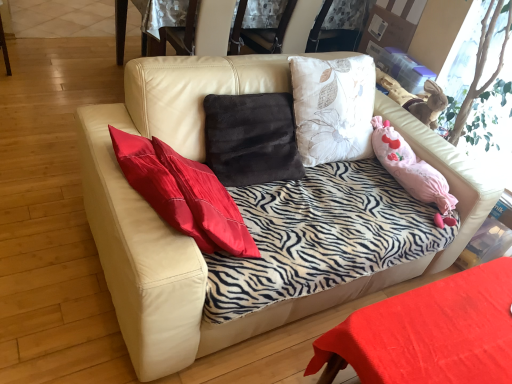
Question: From the image's perspective, is smooth red table at lower right under leather couch at center?

Choices:
 (A) no
 (B) yes

Answer: (B)

Question: From a real-world perspective, is smooth red table at lower right physically below leather couch at center?

Choices:
 (A) yes
 (B) no

Answer: (A)

Question: Can you confirm if smooth red table at lower right is smaller than leather couch at center?

Choices:
 (A) yes
 (B) no

Answer: (A)

Question: Considering the relative sizes of smooth red table at lower right and leather couch at center in the image provided, is smooth red table at lower right taller than leather couch at center?

Choices:
 (A) no
 (B) yes

Answer: (A)

Question: Is the depth of smooth red table at lower right less than that of leather couch at center?

Choices:
 (A) yes
 (B) no

Answer: (B)

Question: Considering the positions of point (181, 296) and point (452, 360), is point (181, 296) closer or farther from the camera than point (452, 360)?

Choices:
 (A) farther
 (B) closer

Answer: (B)

Question: From the image's perspective, is leather couch at center located above or below smooth red table at lower right?

Choices:
 (A) below
 (B) above

Answer: (B)

Question: Considering the positions of leather couch at center and smooth red table at lower right in the image, is leather couch at center wider or thinner than smooth red table at lower right?

Choices:
 (A) thin
 (B) wide

Answer: (B)

Question: In the image, is leather couch at center on the left side or the right side of smooth red table at lower right?

Choices:
 (A) left
 (B) right

Answer: (A)

Question: From the image's perspective, is smooth red table at lower right above or below leather at upper center?

Choices:
 (A) above
 (B) below

Answer: (B)

Question: From a real-world perspective, relative to leather at upper center, is smooth red table at lower right vertically above or below?

Choices:
 (A) above
 (B) below

Answer: (B)

Question: Is smooth red table at lower right in front of or behind leather at upper center in the image?

Choices:
 (A) front
 (B) behind

Answer: (A)

Question: Is smooth red table at lower right wider or thinner than leather at upper center?

Choices:
 (A) thin
 (B) wide

Answer: (B)

Question: Choose the correct answer: Is leather at upper center inside smooth red table at lower right or outside it?

Choices:
 (A) inside
 (B) outside

Answer: (B)

Question: Considering the positions of leather at upper center and smooth red table at lower right in the image, is leather at upper center taller or shorter than smooth red table at lower right?

Choices:
 (A) short
 (B) tall

Answer: (B)